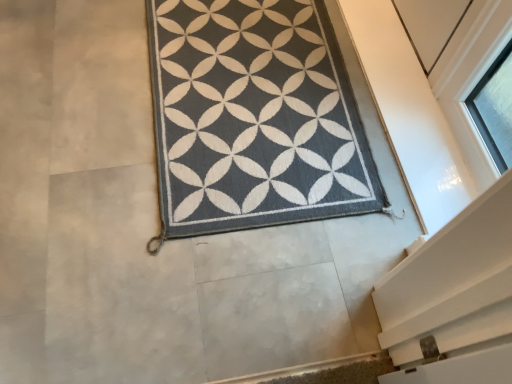
Describe the element at coordinates (254, 118) in the screenshot. This screenshot has height=384, width=512. I see `dark gray textured rug at center` at that location.

You are a GUI agent. You are given a task and a screenshot of the screen. Output one action in this format:
    pyautogui.click(x=<x>, y=<y>)
    Task: Click on the dark gray textured rug at center
    
    Given the screenshot: What is the action you would take?
    pyautogui.click(x=254, y=118)

Find the location of `dark gray textured rug at center`. dark gray textured rug at center is located at coordinates (254, 118).